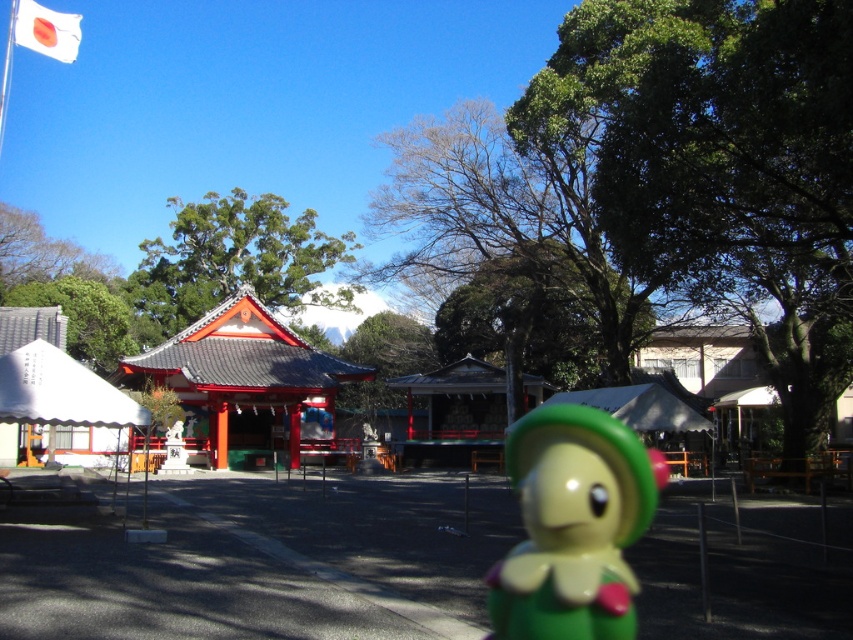
Which is behind, point (576, 548) or point (50, 19)?

Positioned behind is point (50, 19).

Can you confirm if green glossy doll at lower center is thinner than white fabric flag at upper left?

Yes.

Describe the element at coordinates (573, 525) in the screenshot. The width and height of the screenshot is (853, 640). I see `green glossy doll at lower center` at that location.

Image resolution: width=853 pixels, height=640 pixels. Identify the location of green glossy doll at lower center. (573, 525).